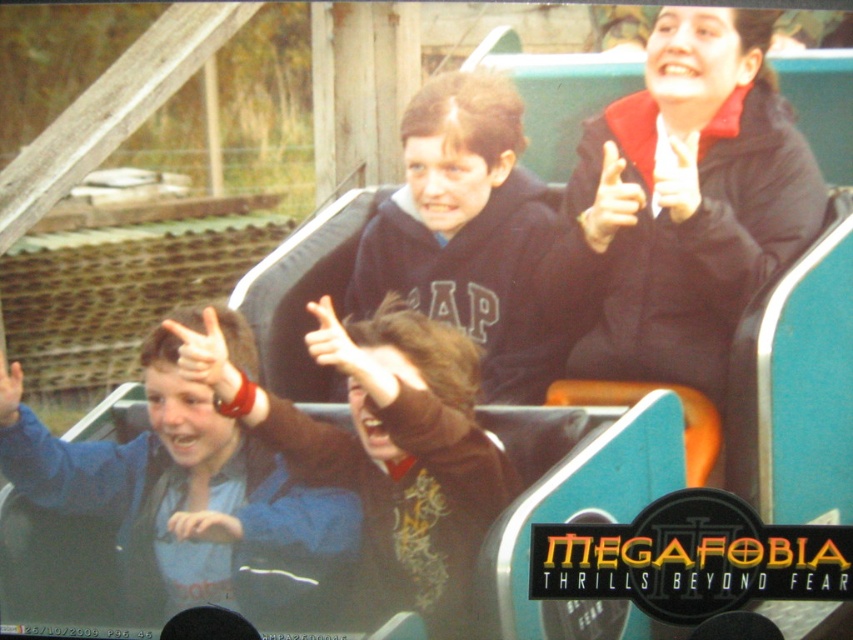
Question: Which point is closer to the camera taking this photo?

Choices:
 (A) (13, 422)
 (B) (439, 120)
 (C) (193, 358)

Answer: (B)

Question: Which point is closer to the camera taking this photo?

Choices:
 (A) (677, 314)
 (B) (177, 355)
 (C) (601, 234)

Answer: (C)

Question: Is matte brown hand at center smaller than matte black hand at upper right?

Choices:
 (A) no
 (B) yes

Answer: (A)

Question: Is the position of black matte jacket at upper right less distant than that of blue fleece jacket at lower left?

Choices:
 (A) no
 (B) yes

Answer: (B)

Question: Which object is positioned closest to the matte black hand at upper right?

Choices:
 (A) blue fleece jacket at lower left
 (B) brown fuzzy sweater at center
 (C) dark blue hoodie at center
 (D) matte brown hand at center

Answer: (C)

Question: Is black matte jacket at upper right wider than matte black hand at upper right?

Choices:
 (A) yes
 (B) no

Answer: (A)